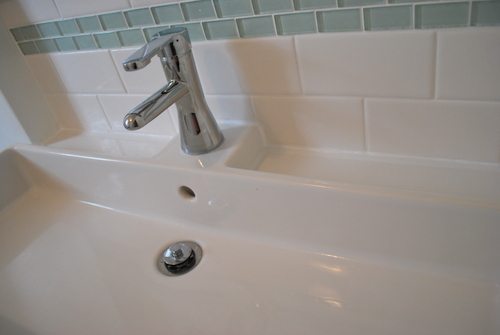
Image resolution: width=500 pixels, height=335 pixels. Identify the location of bottom of sink stopper. (161, 261), (180, 266).